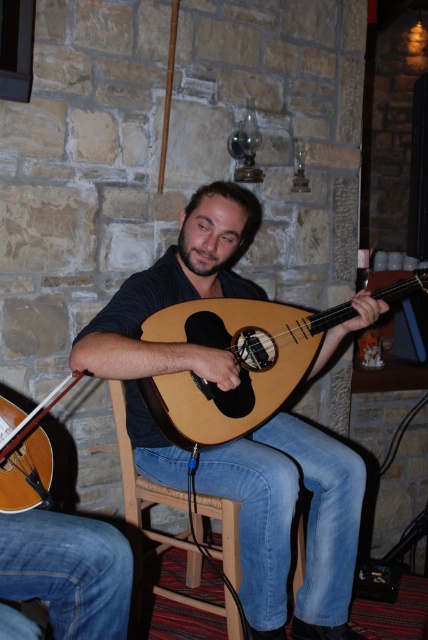
Is point (139, 468) farther from camera compared to point (20, 433)?

Yes.

Where is `matte brown mandolin at center`? This screenshot has width=428, height=640. matte brown mandolin at center is located at coordinates (291, 524).

Which is more to the left, matte brown mandolin at center or wooden chair at center?

wooden chair at center

Between matte brown mandolin at center and wooden chair at center, which one is positioned higher?

matte brown mandolin at center is above.

Which is in front, point (265, 460) or point (190, 580)?

Positioned in front is point (265, 460).

Where is `matte brown mandolin at center`? The height and width of the screenshot is (640, 428). matte brown mandolin at center is located at coordinates (291, 524).

Does matte brown mandolin at center have a greater height compared to natural wood mandolin at center?

Yes.

Can you confirm if matte brown mandolin at center is shorter than natural wood mandolin at center?

In fact, matte brown mandolin at center may be taller than natural wood mandolin at center.

You are a GUI agent. You are given a task and a screenshot of the screen. Output one action in this format:
    pyautogui.click(x=<x>, y=<y>)
    Task: Click on the matte brown mandolin at center
    This screenshot has height=640, width=428.
    Given the screenshot: What is the action you would take?
    pyautogui.click(x=291, y=524)

This screenshot has width=428, height=640. I want to click on matte brown mandolin at center, so click(291, 524).